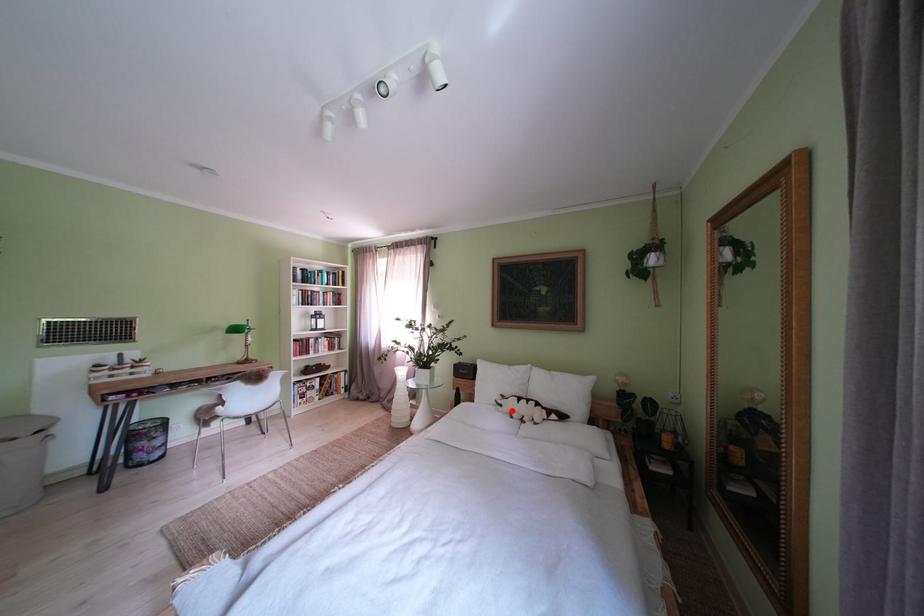
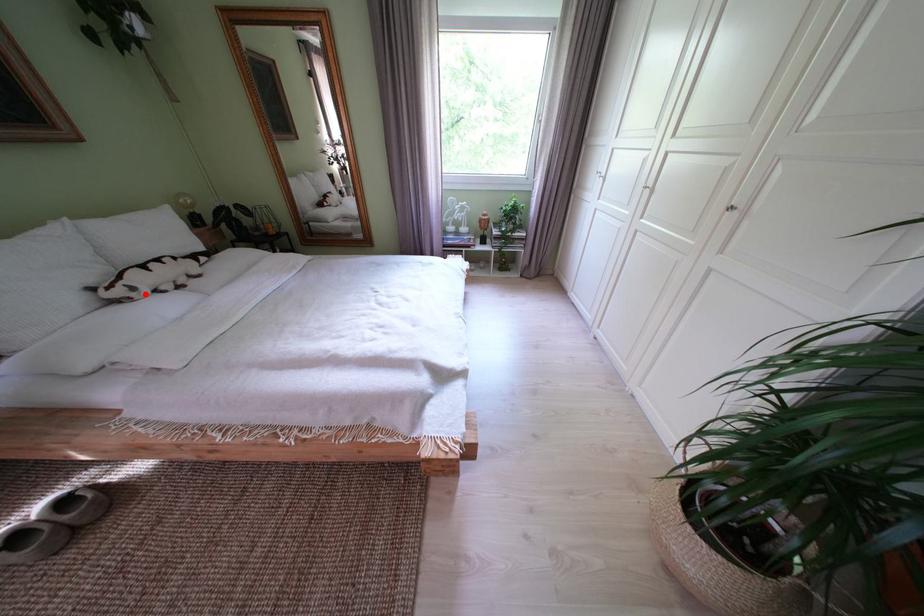
I am providing you with two images of the same scene from different viewpoints. A red point is marked on the first image and another point is marked on the second image. Does the point marked in image1 correspond to the same location as the one in image2?

Yes